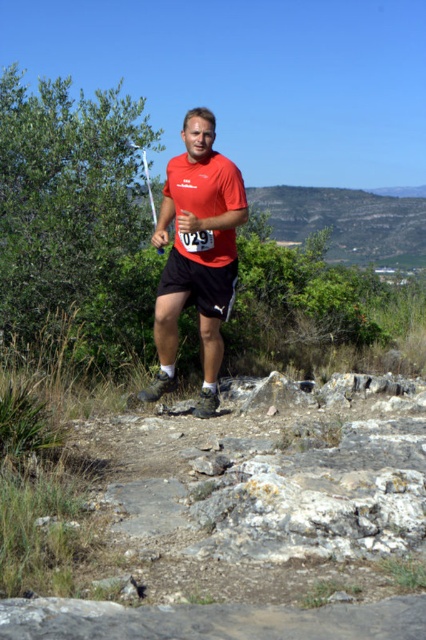
Based on the scene description, which object is taller between the matte red shirt at center and the rugged stone hillside at upper center?

The matte red shirt at center is much taller than the rugged stone hillside at upper center according to the description.

You are a photographer trying to capture the man in the image. You notice the matte red shirt at center and the black matte shorts at center. Which object is positioned closer to your camera lens?

The matte red shirt at center is closer to the viewer than the black matte shorts at center, so the matte red shirt at center is positioned closer to your camera lens.

You are a photographer trying to capture a candid shot of the runner. Your camera has a depth of field that can focus on objects within a 6.5 inch range. If you focus on the matte red shirt at center, will the black matte shorts at center also be in focus?

The distance between the matte red shirt at center and the black matte shorts at center is 6.75 inches. Since the depth of field can only focus within 6.5 inches, the black matte shorts at center will be slightly out of focus.